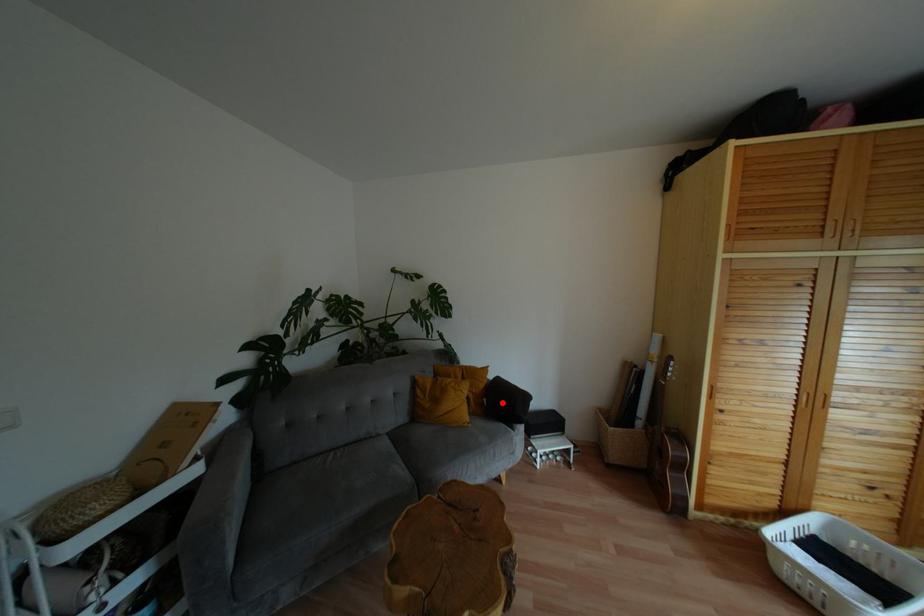
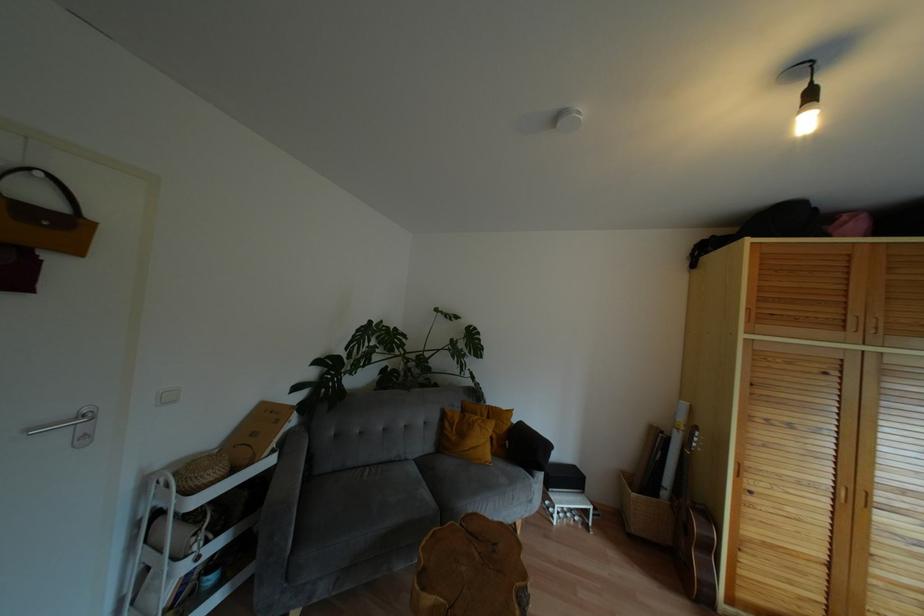
Where in the second image is the point corresponding to the highlighted location from the first image?

(524, 448)